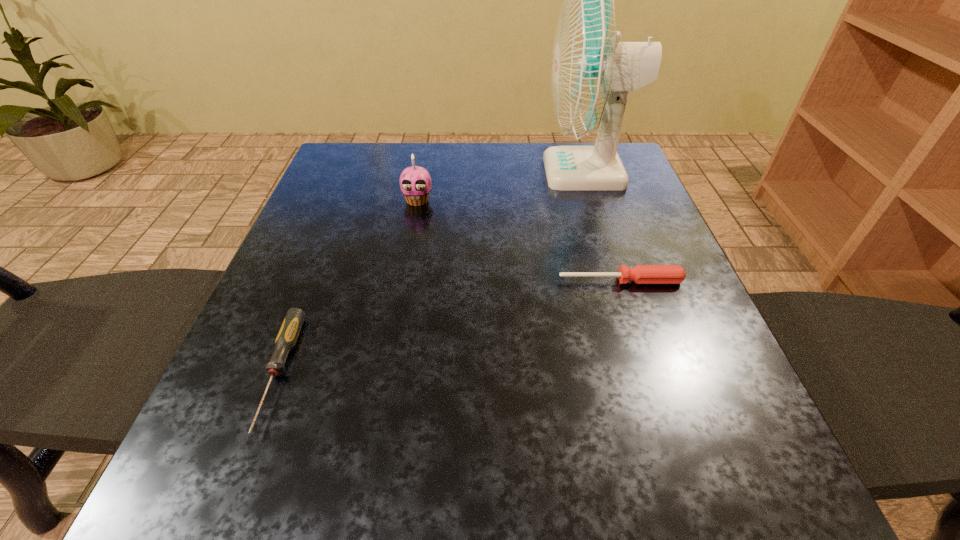
The width and height of the screenshot is (960, 540). In the image, there is a desktop. What are the coordinates of `vacant space at the left edge` in the screenshot? It's located at (303, 302).

Find the location of a particular element. free spot at the right edge of the desktop is located at coordinates (639, 289).

This screenshot has height=540, width=960. Find the location of `vacant region at the far left corner of the desktop`. vacant region at the far left corner of the desktop is located at coordinates (345, 170).

Find the location of `empty space between the tallest object and the third shortest object`. empty space between the tallest object and the third shortest object is located at coordinates (502, 186).

The image size is (960, 540). Find the location of `free space between the farther screwdriver and the fan`. free space between the farther screwdriver and the fan is located at coordinates (603, 226).

What are the coordinates of `free point between the farther screwdriver and the second object from left to right` in the screenshot? It's located at [x=519, y=240].

Where is `free area in between the third farthest object and the fan`? The image size is (960, 540). free area in between the third farthest object and the fan is located at coordinates (603, 226).

Locate an element on the screen. unoccupied area between the farther screwdriver and the nearer screwdriver is located at coordinates (449, 327).

Find the location of a particular element. free spot between the tallest object and the farther screwdriver is located at coordinates (603, 226).

The width and height of the screenshot is (960, 540). Find the location of `free space between the farther screwdriver and the nearest object`. free space between the farther screwdriver and the nearest object is located at coordinates (449, 327).